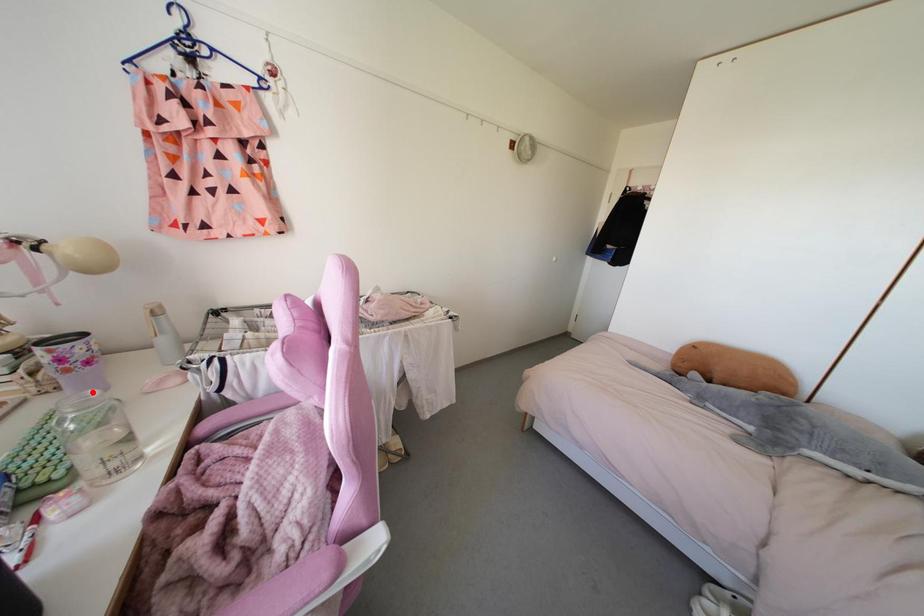
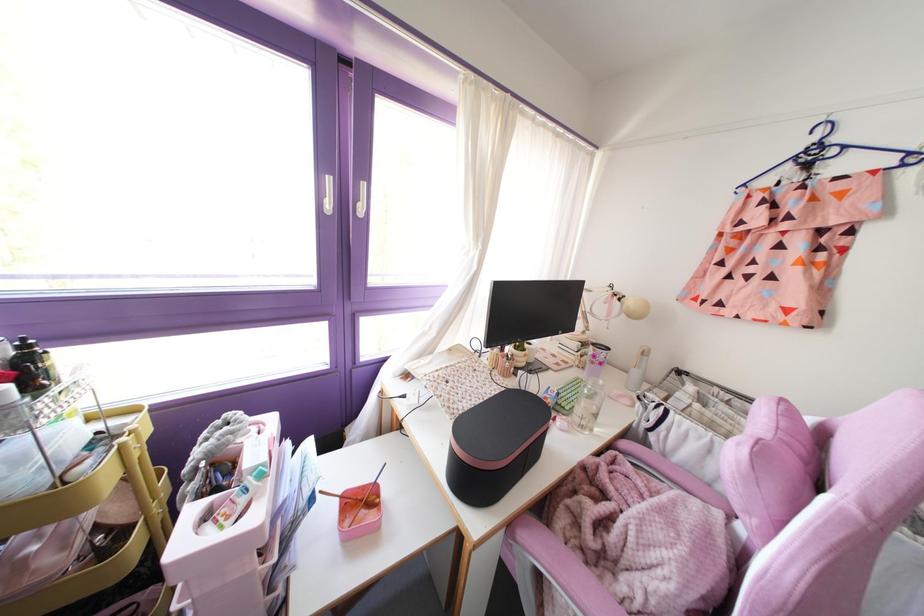
Where in the second image is the point corresponding to the highlighted location from the first image?

(601, 382)